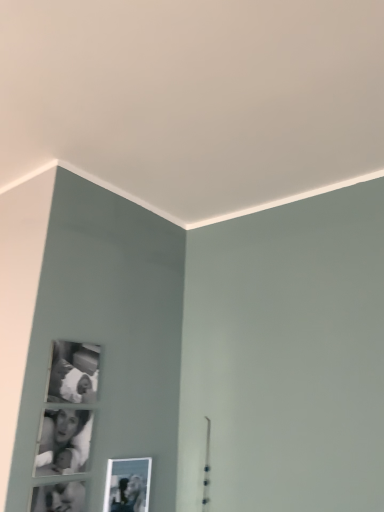
Question: Does black glossy photo frame at lower left have a larger size compared to metallic silver photo frame at lower center, which appears as the second picture frame when viewed from the top?

Choices:
 (A) yes
 (B) no

Answer: (B)

Question: Is black glossy photo frame at lower left further to camera compared to metallic silver photo frame at lower center, the first picture frame in the bottom-to-top sequence?

Choices:
 (A) no
 (B) yes

Answer: (A)

Question: From a real-world perspective, is black glossy photo frame at lower left beneath metallic silver photo frame at lower center, which appears as the first picture frame when viewed from the right?

Choices:
 (A) no
 (B) yes

Answer: (A)

Question: From a real-world perspective, is black glossy photo frame at lower left positioned over metallic silver photo frame at lower center, which appears as the second picture frame when viewed from the top, based on gravity?

Choices:
 (A) yes
 (B) no

Answer: (A)

Question: Considering the relative positions of black glossy photo frame at lower left and metallic silver photo frame at lower center, which appears as the second picture frame when viewed from the top, in the image provided, is black glossy photo frame at lower left to the right of metallic silver photo frame at lower center, which appears as the second picture frame when viewed from the top, from the viewer's perspective?

Choices:
 (A) yes
 (B) no

Answer: (B)

Question: From the image's perspective, does black glossy photo frame at lower left appear lower than metallic silver photo frame at lower center, the first picture frame in the bottom-to-top sequence?

Choices:
 (A) no
 (B) yes

Answer: (A)

Question: Does metallic silver photo frame at lower center, which appears as the second picture frame when viewed from the top, have a smaller size compared to black glossy photo frame at lower left?

Choices:
 (A) no
 (B) yes

Answer: (A)

Question: Does metallic silver photo frame at lower center, which appears as the first picture frame when viewed from the right, have a greater width compared to black glossy photo frame at lower left?

Choices:
 (A) yes
 (B) no

Answer: (A)

Question: Would you consider metallic silver photo frame at lower center, the first picture frame in the bottom-to-top sequence, to be distant from black glossy photo frame at lower left?

Choices:
 (A) no
 (B) yes

Answer: (A)

Question: Considering the relative sizes of metallic silver photo frame at lower center, which appears as the first picture frame when viewed from the right, and black glossy photo frame at lower left in the image provided, is metallic silver photo frame at lower center, which appears as the first picture frame when viewed from the right, bigger than black glossy photo frame at lower left?

Choices:
 (A) no
 (B) yes

Answer: (B)

Question: Is metallic silver photo frame at lower center, the second picture frame in the left-to-right sequence, shorter than black glossy photo frame at lower left?

Choices:
 (A) yes
 (B) no

Answer: (B)

Question: Is metallic silver photo frame at lower center, which appears as the first picture frame when viewed from the right, not inside black glossy photo frame at lower left?

Choices:
 (A) no
 (B) yes

Answer: (B)

Question: Is metallic silver photo frame at lower center, which appears as the first picture frame when viewed from the right, completely or partially inside black matte photo frame at upper left, positioned as the 1th picture frame in top-to-bottom order?

Choices:
 (A) no
 (B) yes

Answer: (A)